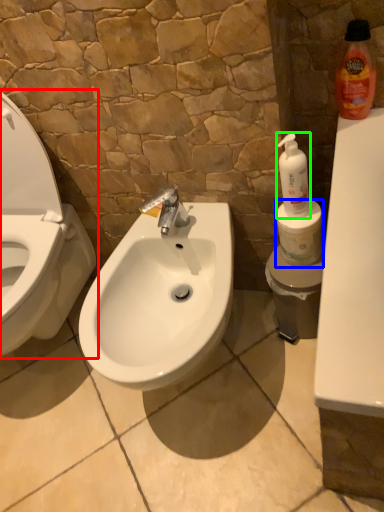
Question: Which object is positioned farthest from toilet (highlighted by a red box)? Select from toilet paper (highlighted by a blue box) and cleaning product (highlighted by a green box).

Choices:
 (A) toilet paper
 (B) cleaning product

Answer: (B)